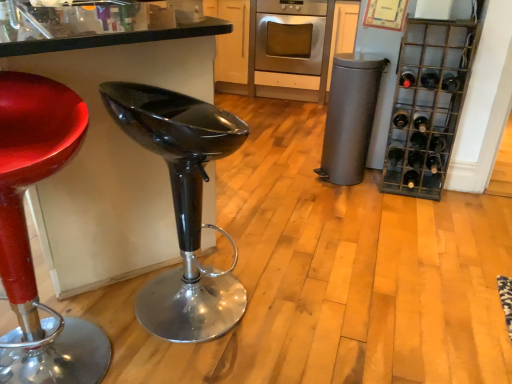
You are a GUI agent. You are given a task and a screenshot of the screen. Output one action in this format:
    pyautogui.click(x=<x>, y=<y>)
    Task: Click on the free area in between glossy black stool at center and black glass wine bottle at lower right, the tenth wine bottle when ordered from top to bottom
    This screenshot has width=512, height=384.
    Given the screenshot: What is the action you would take?
    pyautogui.click(x=317, y=244)